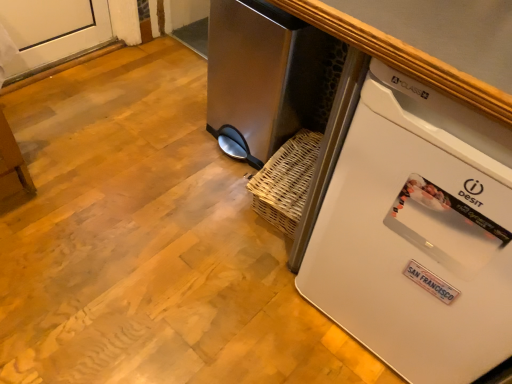
The image size is (512, 384). In order to click on free point to the left of white plastic refrigerator at lower right in this screenshot , I will do `click(230, 308)`.